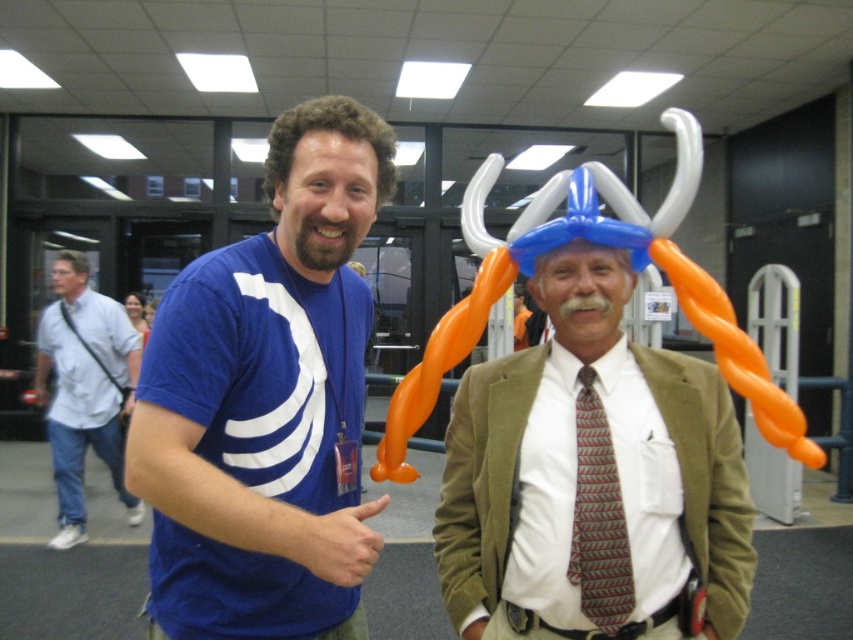
Can you confirm if light blue shirt at left is shorter than striped fabric tie at center?

No, light blue shirt at left is not shorter than striped fabric tie at center.

Can you confirm if light blue shirt at left is bigger than striped fabric tie at center?

Yes, light blue shirt at left is bigger than striped fabric tie at center.

I want to click on light blue shirt at left, so click(84, 388).

Identify the location of light blue shirt at left. Image resolution: width=853 pixels, height=640 pixels. (84, 388).

Is point (656, 541) less distant than point (572, 545)?

No, it is behind (572, 545).

Does matte orange balloon horns at center appear on the right side of striped fabric tie at center?

Correct, you'll find matte orange balloon horns at center to the right of striped fabric tie at center.

Which is in front, point (705, 412) or point (587, 410)?

Point (587, 410) is more forward.

The image size is (853, 640). I want to click on matte orange balloon horns at center, so click(x=590, y=474).

Can you confirm if blue matte t-shirt at center is positioned to the right of light blue shirt at left?

Correct, you'll find blue matte t-shirt at center to the right of light blue shirt at left.

Which is below, blue matte t-shirt at center or light blue shirt at left?

light blue shirt at left is below.

This screenshot has height=640, width=853. What do you see at coordinates (267, 403) in the screenshot?
I see `blue matte t-shirt at center` at bounding box center [267, 403].

Identify the location of blue matte t-shirt at center. This screenshot has width=853, height=640. (267, 403).